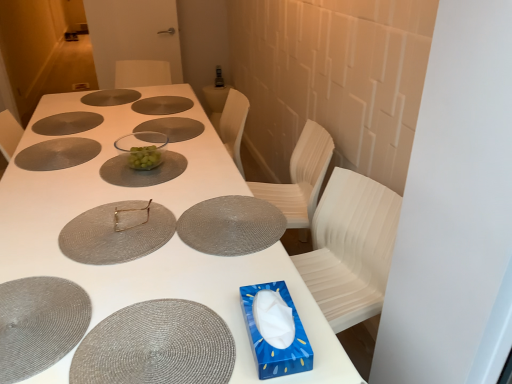
At what (x,y) coordinates should I click in order to perform the action: click on free space to the left of transparent glass bowl at center, which is the fourth glass plate from front to back. Please return your answer as a coordinate pair (x, y). The height and width of the screenshot is (384, 512). Looking at the image, I should click on (66, 164).